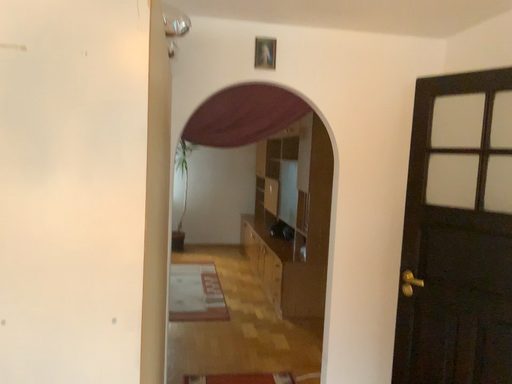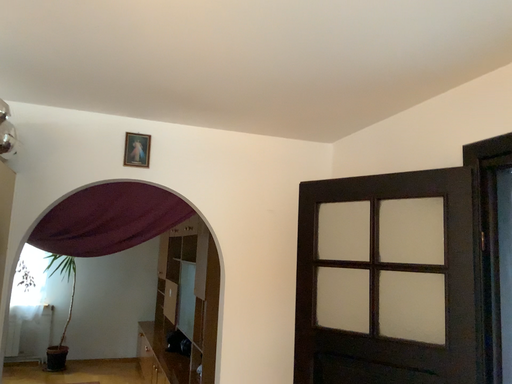
Question: How did the camera likely rotate when shooting the video?

Choices:
 (A) rotated left
 (B) rotated right

Answer: (B)